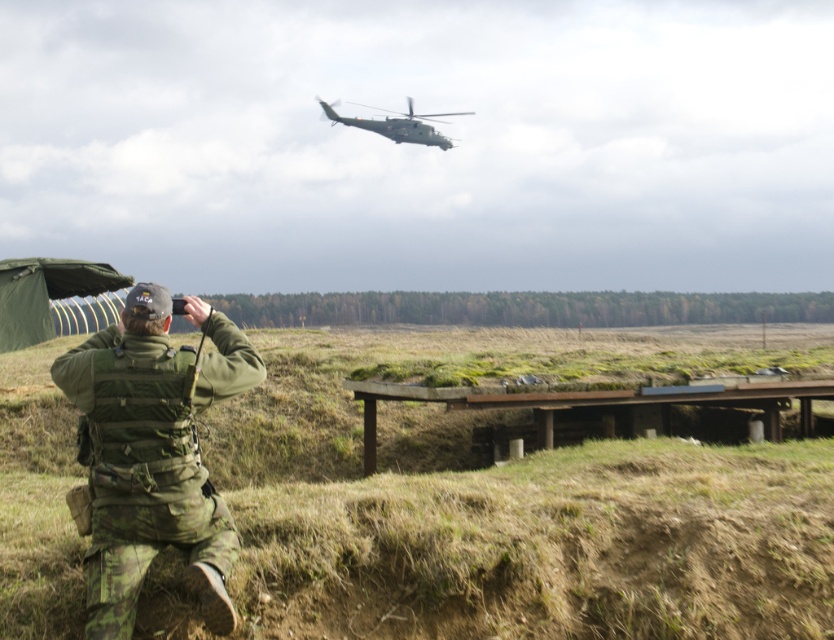
Question: Which object is the closest to the green matte helicopter at upper center?

Choices:
 (A) green camouflage field at lower left
 (B) camouflage fabric uniform at lower left

Answer: (A)

Question: Which point is closer to the camera?

Choices:
 (A) camouflage fabric uniform at lower left
 (B) green camouflage field at lower left
 (C) green matte helicopter at upper center

Answer: (A)

Question: In this image, where is green camouflage field at lower left located relative to camouflage fabric uniform at lower left?

Choices:
 (A) above
 (B) below

Answer: (A)

Question: Does green camouflage field at lower left appear on the right side of camouflage fabric uniform at lower left?

Choices:
 (A) no
 (B) yes

Answer: (B)

Question: Which object is positioned closest to the green camouflage field at lower left?

Choices:
 (A) camouflage fabric uniform at lower left
 (B) green matte helicopter at upper center

Answer: (A)

Question: Can you confirm if camouflage fabric uniform at lower left is thinner than green matte helicopter at upper center?

Choices:
 (A) no
 (B) yes

Answer: (B)